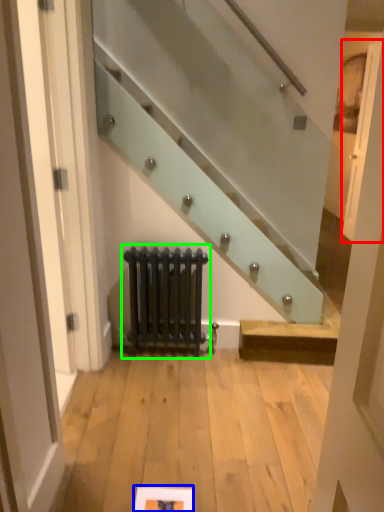
Question: Considering the real-world distances, which object is farthest from door (highlighted by a red box)? picture frame (highlighted by a blue box) or radiator (highlighted by a green box)?

Choices:
 (A) picture frame
 (B) radiator

Answer: (A)